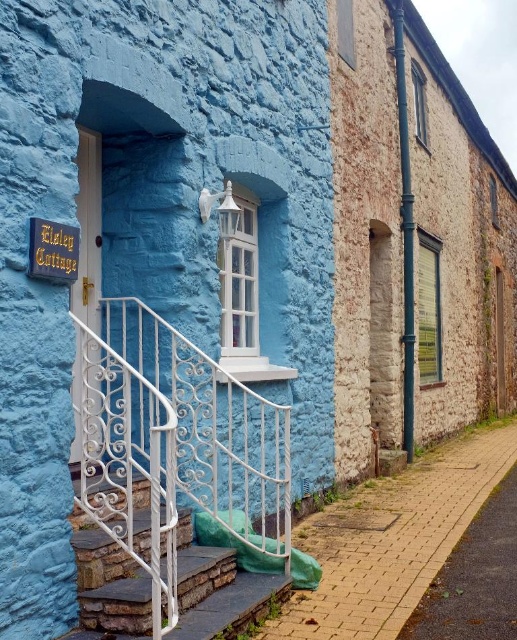
Question: Which object is farther from the camera taking this photo?

Choices:
 (A) white wrought iron stairs at lower left
 (B) white wrought iron railing at lower left

Answer: (A)

Question: Does white wrought iron railing at lower left come in front of white wrought iron stairs at lower left?

Choices:
 (A) no
 (B) yes

Answer: (B)

Question: Which object appears farthest from the camera in this image?

Choices:
 (A) white wrought iron stairs at lower left
 (B) white wrought iron railing at lower left

Answer: (A)

Question: Is white wrought iron railing at lower left thinner than white wrought iron stairs at lower left?

Choices:
 (A) no
 (B) yes

Answer: (A)

Question: Is white wrought iron railing at lower left closer to camera compared to white wrought iron stairs at lower left?

Choices:
 (A) no
 (B) yes

Answer: (B)

Question: Which object appears farthest from the camera in this image?

Choices:
 (A) white wrought iron stairs at lower left
 (B) white wrought iron railing at lower left

Answer: (A)